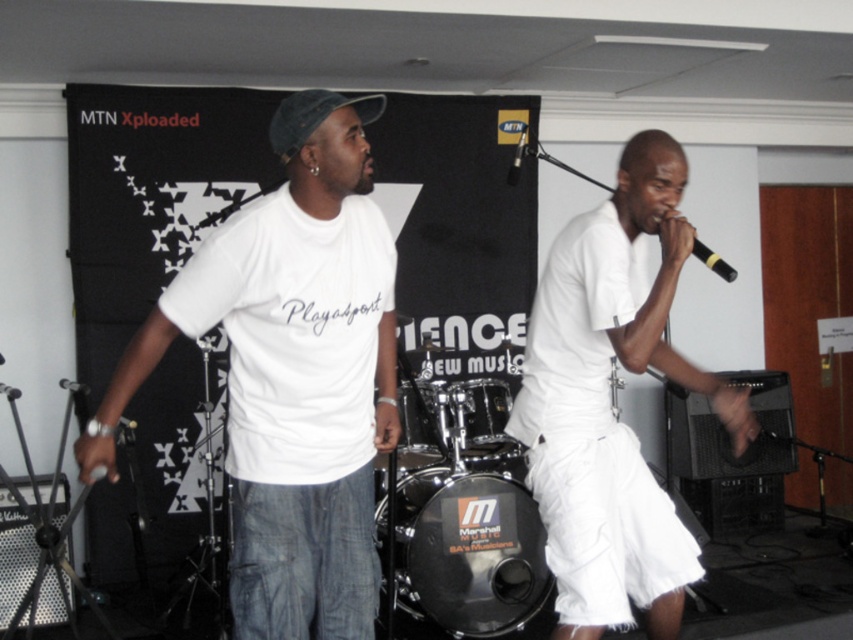
You are a photographer positioned at the front of the stage. You need to capture a shot that includes both the black mesh drum at center and the black matte microphone at upper right. Based on their positions, which object should you adjust your camera angle to focus on first to ensure both are in frame?

The black mesh drum at center is to the left of the black matte microphone at upper right, so you should first focus on the black matte microphone at upper right to ensure both objects are included in the frame.

You are a stagehand who needs to place a new monitor at point (469, 552). According to the image, what object is currently at that location?

The black mesh drum at center is located at point (469, 552).